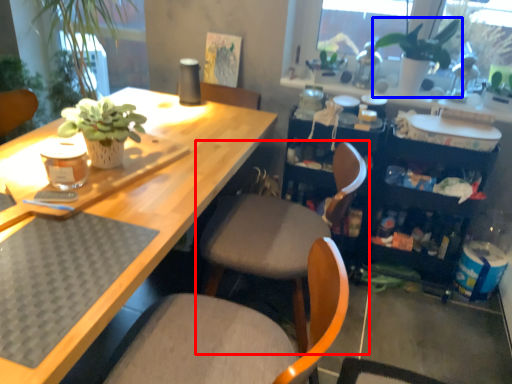
Question: Which object is further to the camera taking this photo, chair (highlighted by a red box) or houseplant (highlighted by a blue box)?

Choices:
 (A) chair
 (B) houseplant

Answer: (B)